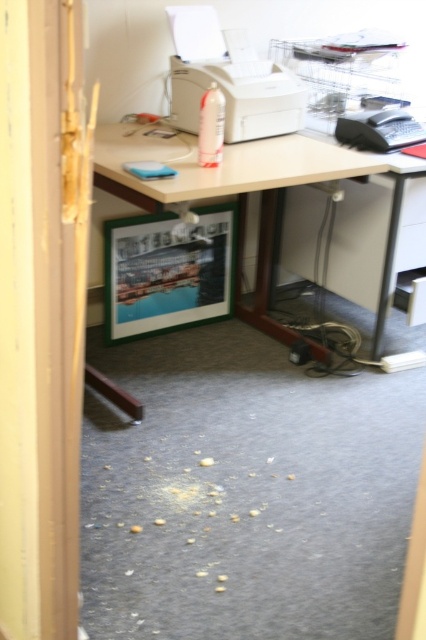
Question: Which of the following is the farthest from the observer?

Choices:
 (A) (264, 176)
 (B) (193, 99)

Answer: (B)

Question: Which of the following is the farthest from the observer?

Choices:
 (A) white plastic printer at center
 (B) black plastic telephone at right
 (C) wooden desk at center

Answer: (B)

Question: Is wooden desk at center to the right of white plastic printer at center from the viewer's perspective?

Choices:
 (A) no
 (B) yes

Answer: (B)

Question: Does wooden desk at center appear on the right side of black plastic telephone at right?

Choices:
 (A) yes
 (B) no

Answer: (B)

Question: Does white plastic printer at center appear on the right side of black plastic telephone at right?

Choices:
 (A) no
 (B) yes

Answer: (A)

Question: Estimate the real-world distances between objects in this image. Which object is farther from the wooden desk at center?

Choices:
 (A) white plastic printer at center
 (B) black plastic telephone at right

Answer: (B)